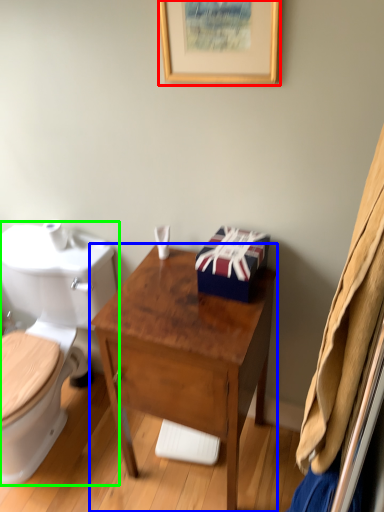
Question: Based on their relative distances, which object is farther from picture frame (highlighted by a red box)? Choose from desk (highlighted by a blue box) and toilet (highlighted by a green box).

Choices:
 (A) desk
 (B) toilet

Answer: (B)